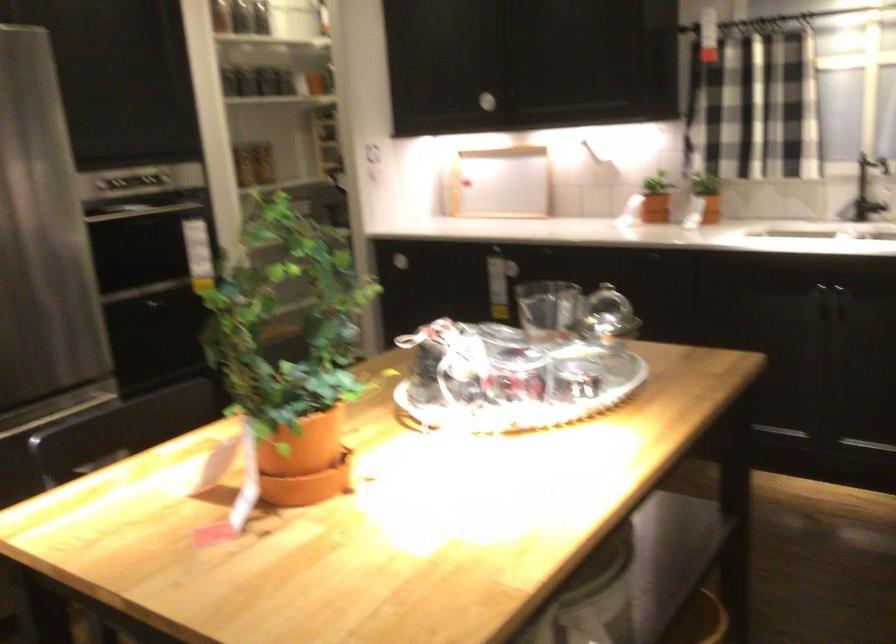
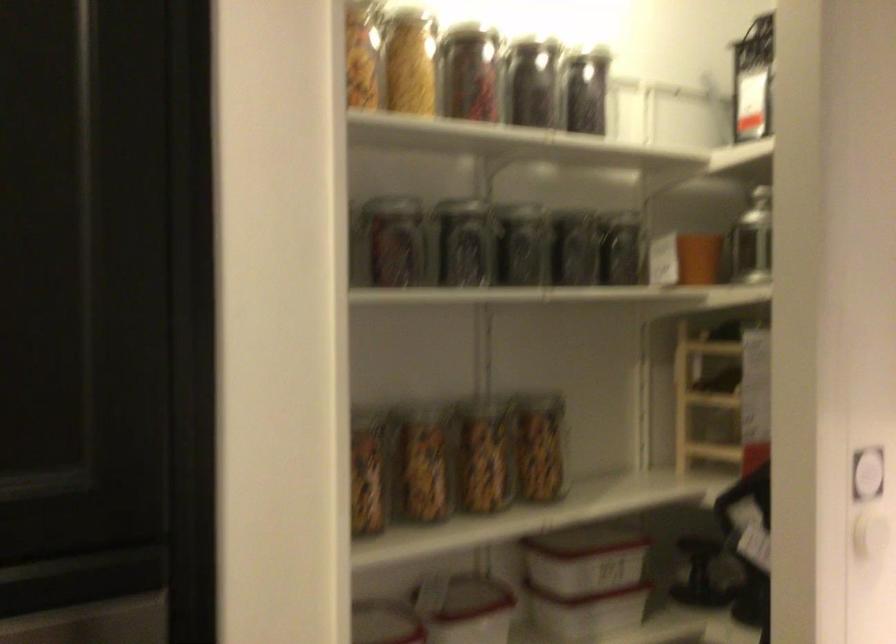
Find the pixel in the second image that matches [265,69] in the first image.

(574, 249)